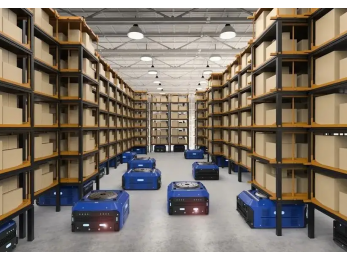
Locate an element on the screen. rear (horizontal) shelving unit is located at coordinates (166, 108).